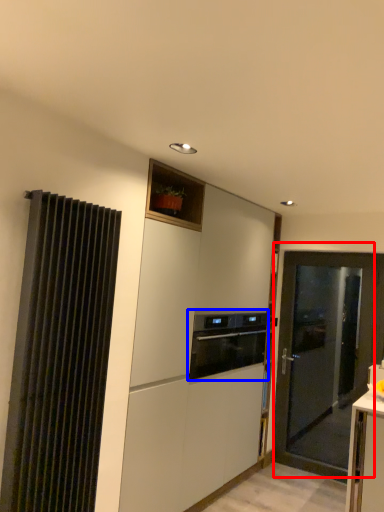
Question: Which of the following is the farthest to the observer, door (highlighted by a red box) or home appliance (highlighted by a blue box)?

Choices:
 (A) door
 (B) home appliance

Answer: (A)